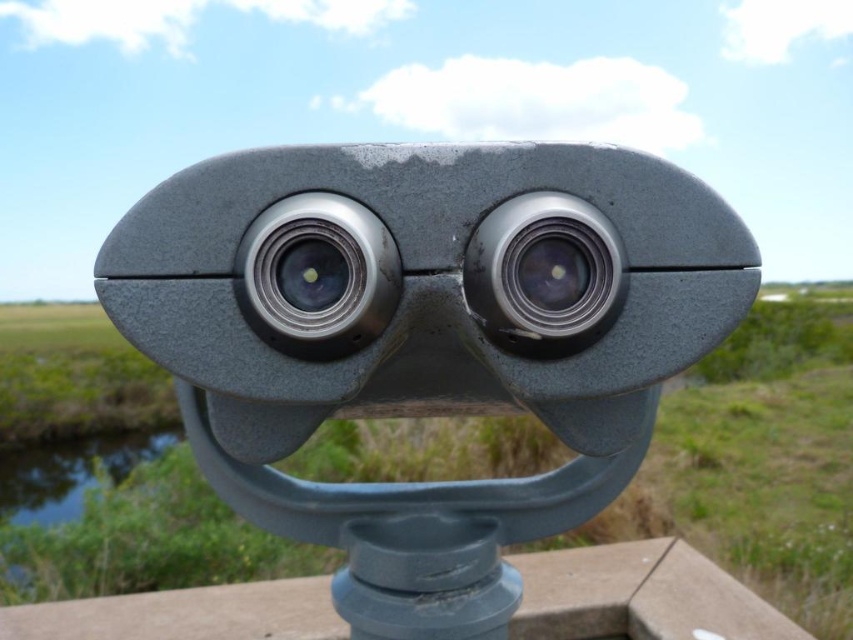
Is matte gray telescope at center above satin silver lens at center?

Incorrect, matte gray telescope at center is not positioned above satin silver lens at center.

Between matte gray telescope at center and satin silver lens at center, which one is positioned higher?

Positioned higher is satin silver lens at center.

The image size is (853, 640). What do you see at coordinates (424, 339) in the screenshot?
I see `matte gray telescope at center` at bounding box center [424, 339].

Locate an element on the screen. matte gray telescope at center is located at coordinates (424, 339).

Where is `metallic silver lens at center`? metallic silver lens at center is located at coordinates (317, 276).

Does point (250, 326) come farther from viewer compared to point (556, 204)?

Yes, it is.

Does point (354, 237) lie in front of point (519, 296)?

That is True.

The height and width of the screenshot is (640, 853). Identify the location of metallic silver lens at center. (317, 276).

Is matte gray telescope at center to the left of metallic silver lens at center from the viewer's perspective?

In fact, matte gray telescope at center is to the right of metallic silver lens at center.

Can you confirm if matte gray telescope at center is positioned below metallic silver lens at center?

Correct, matte gray telescope at center is located below metallic silver lens at center.

Who is more distant from viewer, (285, 413) or (297, 314)?

Point (285, 413)

At what (x,y) coordinates should I click in order to perform the action: click on matte gray telescope at center. Please return your answer as a coordinate pair (x, y). The width and height of the screenshot is (853, 640). Looking at the image, I should click on (424, 339).